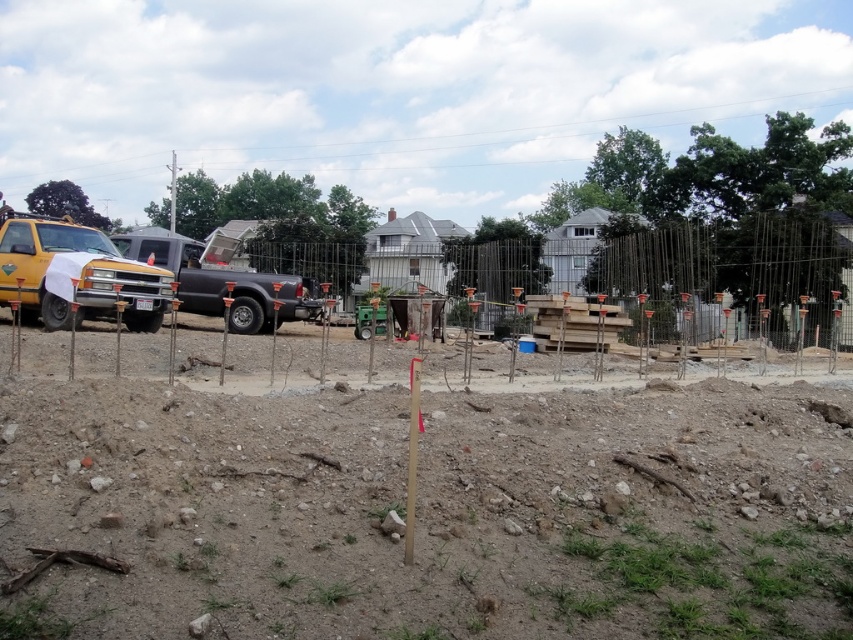
You are a delivery driver who needs to park your truck in this construction site. You see the matte yellow truck at left and the black matte truck at center. Which truck takes up more space in the parking area?

The black matte truck at center occupies more space than the matte yellow truck at left, so the black matte truck at center takes up more space in the parking area.

You are a construction worker needing to access both the matte yellow truck at left and the black matte truck at center. Which truck would you need to move first to get to the one behind it?

The black matte truck at center is behind the matte yellow truck at left, so you would need to move the matte yellow truck at left first to access the black matte truck at center.

Based on the photo, you are a construction worker who needs to place a new wooden stake exactly at the center of the brown sandy soil at center. Based on the image, what are the coordinates where you should place the stake?

The coordinates for the center of the brown sandy soil at center are at point (433, 513).